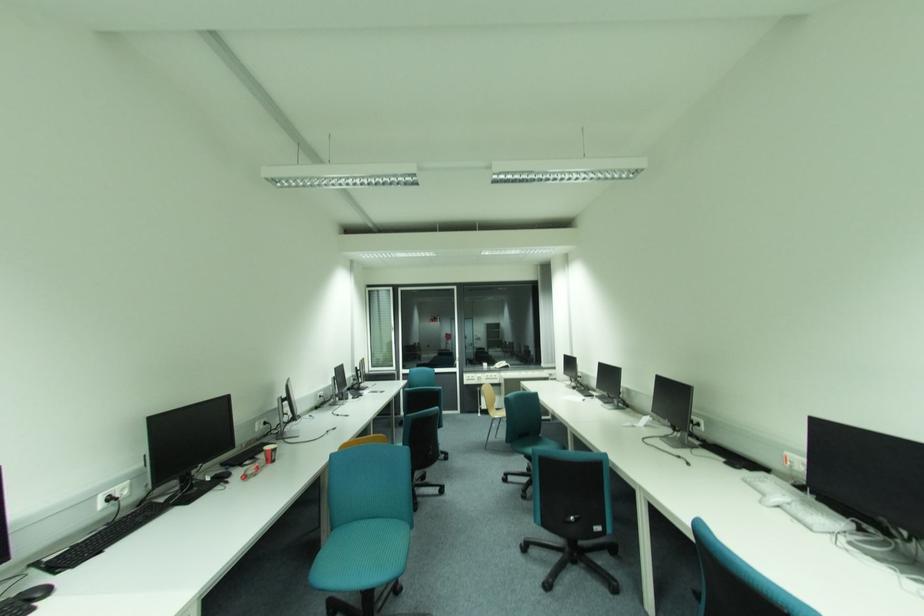
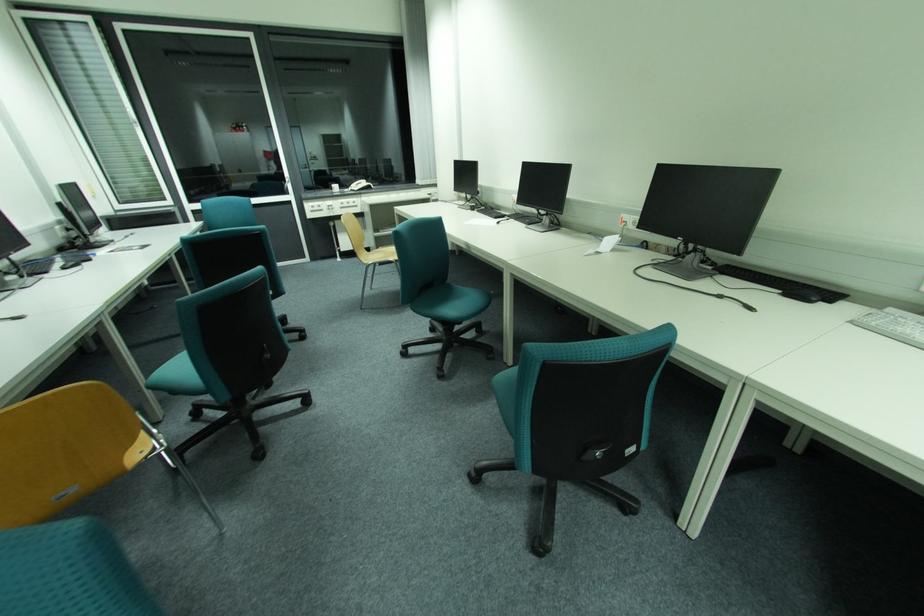
In the second image, find the point that corresponds to [501,367] in the first image.

(357, 188)